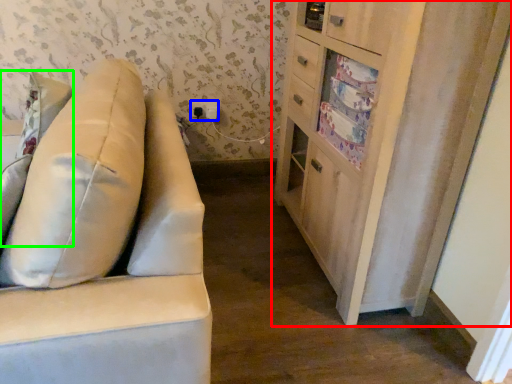
Question: Which object is the closest to the cabinetry (highlighted by a red box)? Choose among these: electric outlet (highlighted by a blue box) or pillow (highlighted by a green box).

Choices:
 (A) electric outlet
 (B) pillow

Answer: (B)